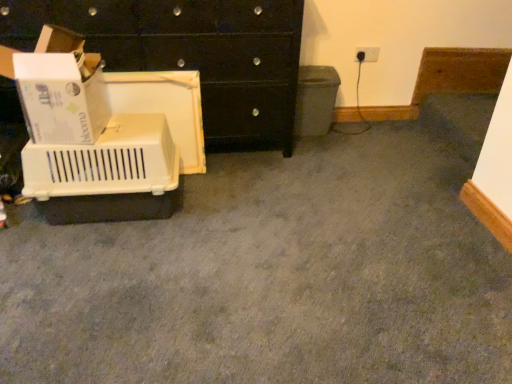
Question: Based on their sizes in the image, would you say beige plastic crate at left is bigger or smaller than white plastic electric outlet at upper right?

Choices:
 (A) small
 (B) big

Answer: (B)

Question: Considering their positions, is beige plastic crate at left located in front of or behind white plastic electric outlet at upper right?

Choices:
 (A) behind
 (B) front

Answer: (B)

Question: Which object is positioned closest to the beige plastic crate at left?

Choices:
 (A) black glossy chest of drawers at upper left
 (B) matte gray recycling bin at center-right
 (C) white plastic electric outlet at upper right
 (D) white cardboard box at left

Answer: (D)

Question: Which object is positioned farthest from the beige plastic crate at left?

Choices:
 (A) black glossy chest of drawers at upper left
 (B) matte gray recycling bin at center-right
 (C) white plastic electric outlet at upper right
 (D) white cardboard box at left

Answer: (C)